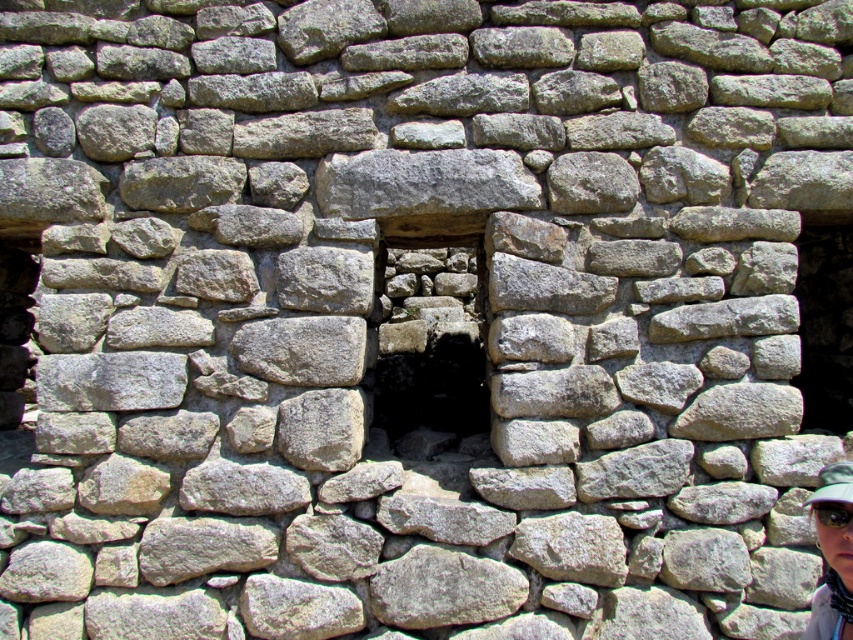
You are a delivery robot with a 6.5 inch wide package that needs to place between the matte gray hat at lower right and the black fabric baseball cap at lower right. Can you fit the package between them?

The matte gray hat at lower right and the black fabric baseball cap at lower right are 7.19 inches apart, so yes, the 6.5 inch wide package can fit between them since the space is wider than the package.

You are an architect examining a historical stone wall. You notice the natural stone window at center and the black fabric baseball cap at lower right. Which object is taller?

The natural stone window at center is much taller than the black fabric baseball cap at lower right.